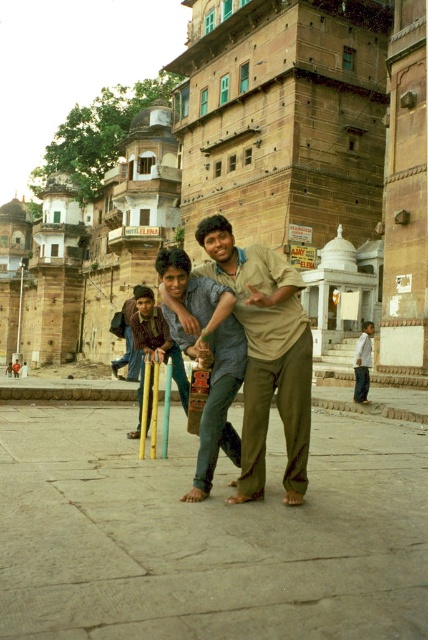
Does light brown cotton shirt at center have a greater height compared to white cotton shirt at lower right?

Yes, light brown cotton shirt at center is taller than white cotton shirt at lower right.

Looking at this image, can you confirm if light brown cotton shirt at center is positioned to the left of white cotton shirt at lower right?

Correct, you'll find light brown cotton shirt at center to the left of white cotton shirt at lower right.

The image size is (428, 640). What do you see at coordinates (265, 355) in the screenshot?
I see `light brown cotton shirt at center` at bounding box center [265, 355].

Where is `light brown cotton shirt at center`? light brown cotton shirt at center is located at coordinates (265, 355).

Is blue denim jeans at center behind white cotton shirt at lower right?

No, it is not.

Between blue denim jeans at center and white cotton shirt at lower right, which one has more height?

blue denim jeans at center is taller.

Who is more forward, (130, 376) or (362, 346)?

Point (130, 376) is more forward.

The image size is (428, 640). I want to click on blue denim jeans at center, so click(x=127, y=342).

Is brown cotton shirt at center above wooden cricket bats at center?

Yes, brown cotton shirt at center is above wooden cricket bats at center.

Which is in front, point (225, 412) or point (143, 291)?

Point (225, 412) is in front.

Consider the image. Who is more forward, (219, 433) or (134, 292)?

Point (219, 433) is in front.

At what (x,y) coordinates should I click in order to perform the action: click on brown cotton shirt at center. Please return your answer as a coordinate pair (x, y). The width and height of the screenshot is (428, 640). Looking at the image, I should click on (207, 358).